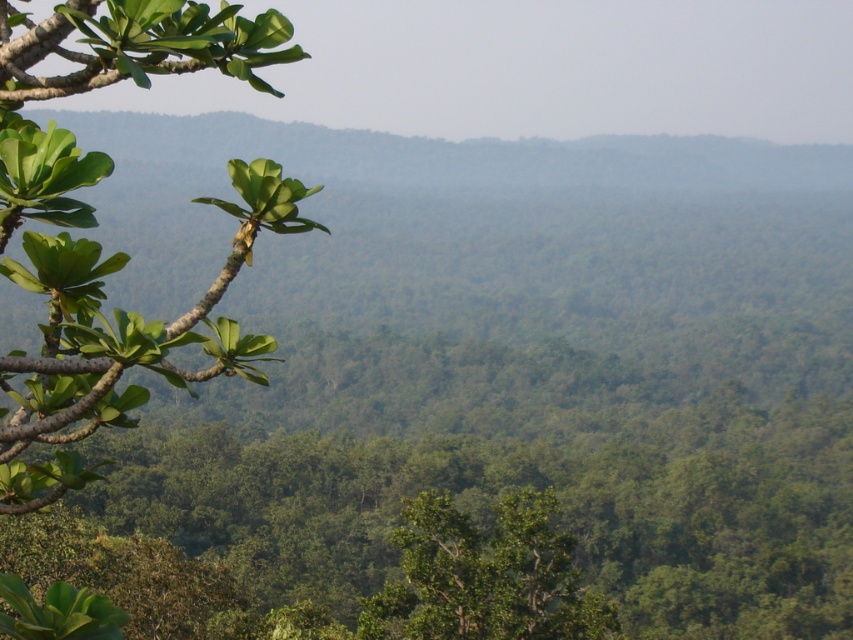
You are a bird soaring above the forest. You spot the green matte leafy branch at left and the green leafy tree at center. Which one is closer to you?

The green matte leafy branch at left is closer to you because it is positioned in front of the green leafy tree at center.

You are a hiker trying to navigate through the forest. You see two points marked in the image. Which point is closer to you, point (167, 45) or point (498, 596)?

Point (167, 45) is closer to the viewer than point (498, 596).